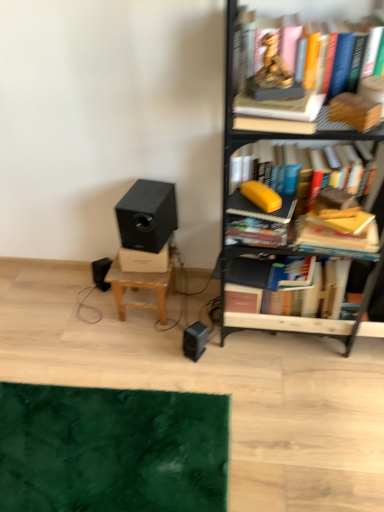
Locate an element on the screen. free area in between wooden stool at lower center and black plastic speaker at lower center is located at coordinates (176, 326).